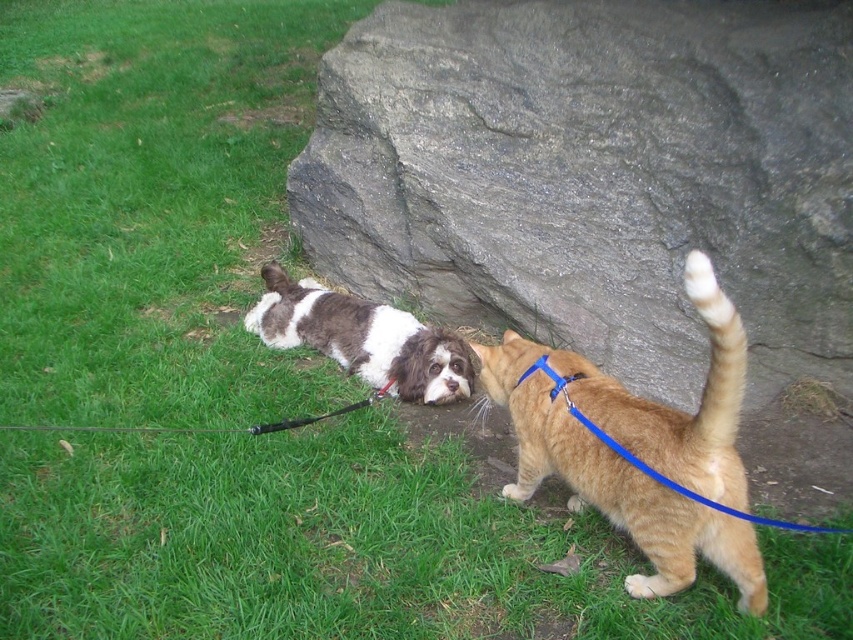
Can you confirm if orange tabby cat at lower right is positioned to the left of black rubber leash at lower center?

Incorrect, orange tabby cat at lower right is not on the left side of black rubber leash at lower center.

Is orange tabby cat at lower right wider than black rubber leash at lower center?

Incorrect, orange tabby cat at lower right's width does not surpass black rubber leash at lower center's.

I want to click on orange tabby cat at lower right, so click(x=642, y=449).

Between point (315, 284) and point (389, 381), which one is positioned behind?

Positioned behind is point (315, 284).

Which is more to the right, brown and white fur at center or black rubber leash at lower center?

Positioned to the right is brown and white fur at center.

Between point (357, 368) and point (61, 428), which one is positioned behind?

Point (357, 368)

The image size is (853, 640). In order to click on brown and white fur at center in this screenshot , I will do `click(363, 339)`.

Based on the photo, is orange tabby cat at lower right shorter than brown and white fur at center?

No, orange tabby cat at lower right is not shorter than brown and white fur at center.

Looking at this image, measure the distance between orange tabby cat at lower right and brown and white fur at center.

orange tabby cat at lower right and brown and white fur at center are 37.32 inches apart.

Is point (668, 541) positioned in front of point (450, 349)?

That is True.

This screenshot has height=640, width=853. Identify the location of orange tabby cat at lower right. (642, 449).